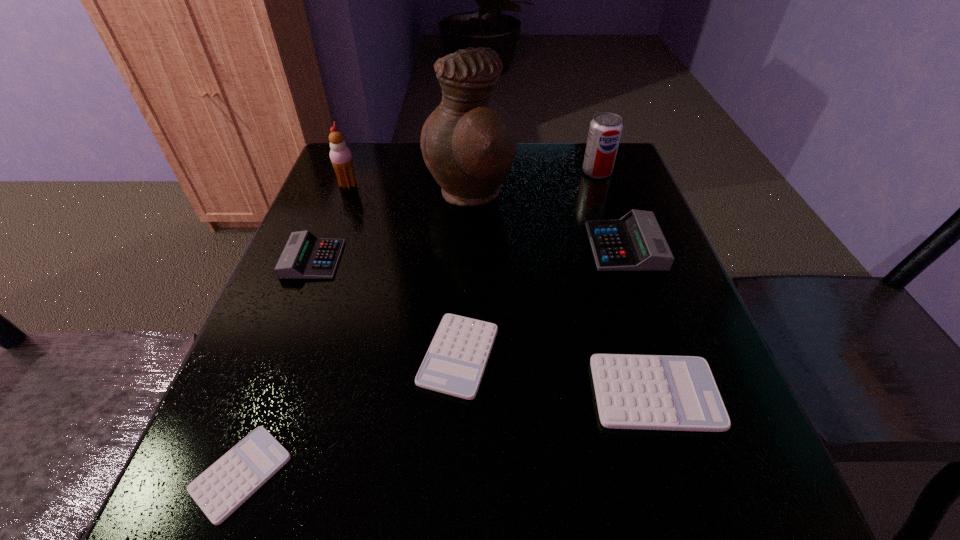
Locate an element on the screen. The height and width of the screenshot is (540, 960). vacant point that satisfies the following two spatial constraints: 1. at the spout of the third shortest calculator; 2. on the right side of the brown pitcher is located at coordinates (465, 393).

Where is `free space that satisfies the following two spatial constraints: 1. at the spout of the tallest object; 2. on the front side of the fourth tallest calculator`? The width and height of the screenshot is (960, 540). free space that satisfies the following two spatial constraints: 1. at the spout of the tallest object; 2. on the front side of the fourth tallest calculator is located at coordinates (466, 356).

Image resolution: width=960 pixels, height=540 pixels. What are the coordinates of `free spot that satisfies the following two spatial constraints: 1. at the front with a straw on the fourth tallest object; 2. on the right side of the icecream` in the screenshot? It's located at pyautogui.click(x=324, y=246).